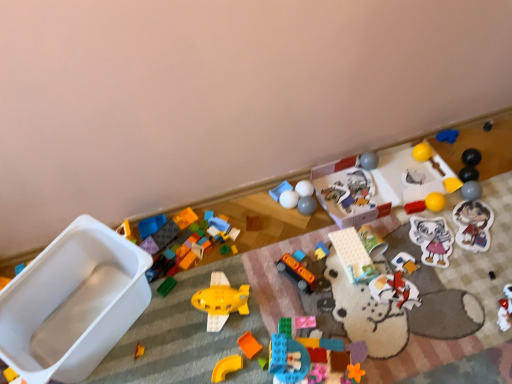
The image size is (512, 384). In order to click on free area in between matte plastic stickers at lower right, which is counted as the third toy, starting from the right, and yellow plastic curve at center, the fifth toy in the left-to-right sequence in this screenshot , I will do `click(385, 280)`.